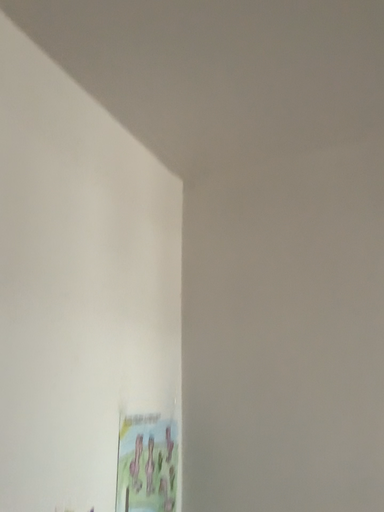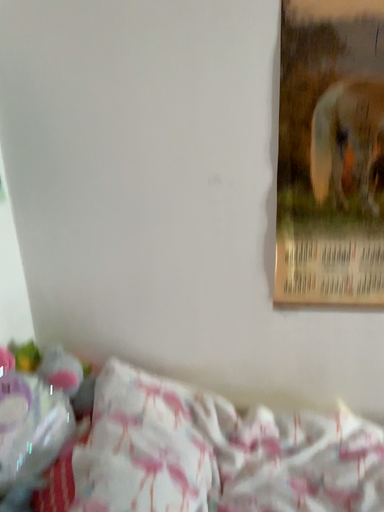
Question: Which way did the camera rotate in the video?

Choices:
 (A) rotated upward
 (B) rotated downward

Answer: (B)